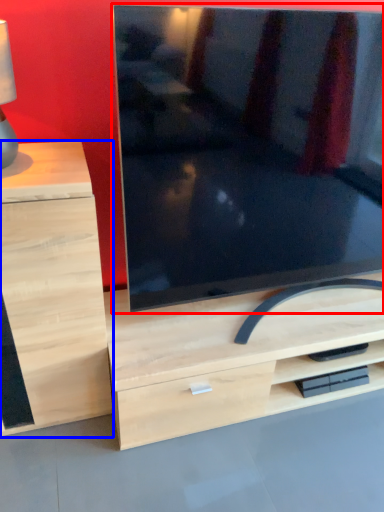
Question: Which of the following is the farthest to the observer, television (highlighted by a red box) or chest of drawers (highlighted by a blue box)?

Choices:
 (A) television
 (B) chest of drawers

Answer: (B)